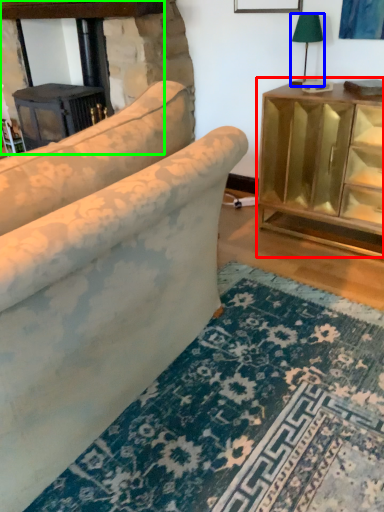
Question: Estimate the real-world distances between objects in this image. Which object is closer to table (highlighted by a red box), table lamp (highlighted by a blue box) or fireplace (highlighted by a green box)?

Choices:
 (A) table lamp
 (B) fireplace

Answer: (A)